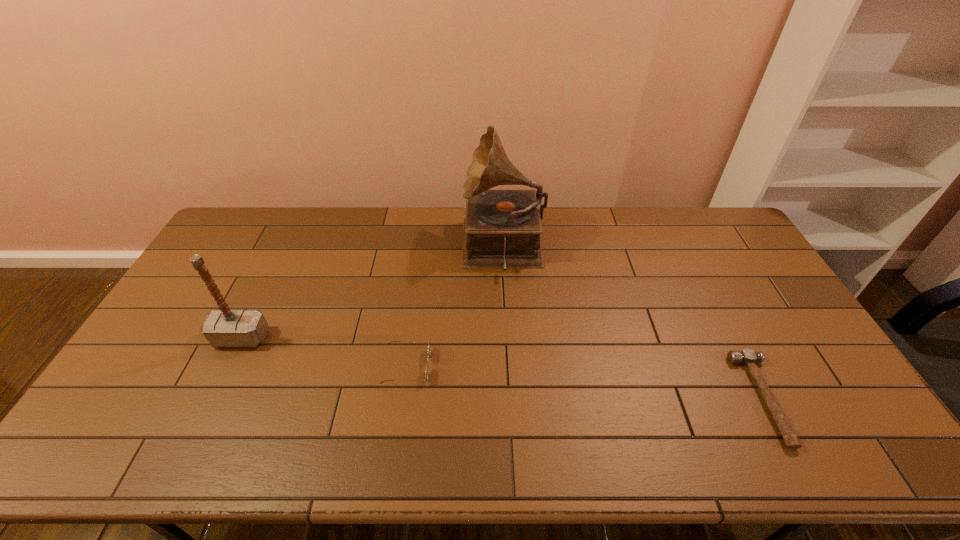
Where is `the third object from left to right`? This screenshot has width=960, height=540. the third object from left to right is located at coordinates (502, 228).

You are a GUI agent. You are given a task and a screenshot of the screen. Output one action in this format:
    pyautogui.click(x=<x>, y=<y>)
    Task: Click on the tallest object
    
    Given the screenshot: What is the action you would take?
    pyautogui.click(x=502, y=228)

You are a GUI agent. You are given a task and a screenshot of the screen. Output one action in this format:
    pyautogui.click(x=<x>, y=<y>)
    Task: Click on the farther hammer
    The image size is (960, 540).
    Given the screenshot: What is the action you would take?
    pyautogui.click(x=224, y=327)

You are a GUI agent. You are given a task and a screenshot of the screen. Output one action in this format:
    pyautogui.click(x=<x>, y=<y>)
    Task: Click on the left hammer
    
    Given the screenshot: What is the action you would take?
    pyautogui.click(x=224, y=327)

At what (x,y) coordinates should I click in order to perform the action: click on the second shortest object. Please return your answer as a coordinate pair (x, y). Image resolution: width=960 pixels, height=540 pixels. Looking at the image, I should click on (426, 380).

What are the coordinates of `the second object from left to right` in the screenshot? It's located at (426, 380).

At what (x,y) coordinates should I click in order to perform the action: click on the shorter hammer. Please return your answer as a coordinate pair (x, y). This screenshot has height=540, width=960. Looking at the image, I should click on [748, 357].

You are a GUI agent. You are given a task and a screenshot of the screen. Output one action in this format:
    pyautogui.click(x=<x>, y=<y>)
    Task: Click on the right hammer
    The height and width of the screenshot is (540, 960).
    Given the screenshot: What is the action you would take?
    pyautogui.click(x=748, y=357)

This screenshot has height=540, width=960. Find the location of `free point located from the horn of the record player`. free point located from the horn of the record player is located at coordinates (443, 248).

Locate an element on the screen. vacant space situated 0.320m from the horn of the record player is located at coordinates (373, 248).